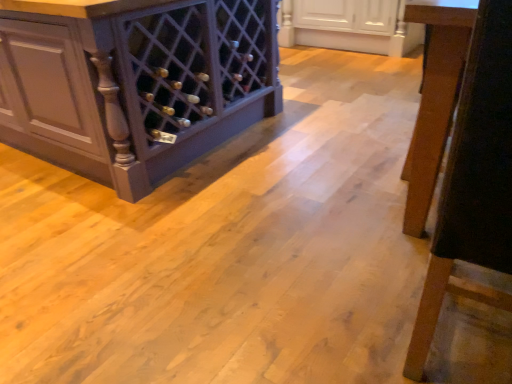
Question: From the image's perspective, is matte dark wood wine rack at left, the 1th cabinetry from the left, on top of wooden chair leg at right?

Choices:
 (A) yes
 (B) no

Answer: (A)

Question: Is matte dark wood wine rack at left, which ranks as the 2th cabinetry in right-to-left order, bigger than wooden chair leg at right?

Choices:
 (A) no
 (B) yes

Answer: (B)

Question: From the image's perspective, is matte dark wood wine rack at left, which ranks as the 2th cabinetry in right-to-left order, located beneath wooden chair leg at right?

Choices:
 (A) yes
 (B) no

Answer: (B)

Question: Is wooden chair leg at right surrounded by matte dark wood wine rack at left, which ranks as the 2th cabinetry in right-to-left order?

Choices:
 (A) yes
 (B) no

Answer: (B)

Question: Is matte dark wood wine rack at left, the 1th cabinetry from the left, aimed at wooden chair leg at right?

Choices:
 (A) yes
 (B) no

Answer: (B)

Question: From a real-world perspective, is matte dark wood wine rack at left, which ranks as the 2th cabinetry in right-to-left order, above or below wooden chair leg at right?

Choices:
 (A) below
 (B) above

Answer: (A)

Question: Based on their positions, is matte dark wood wine rack at left, which ranks as the 2th cabinetry in right-to-left order, located to the left or right of wooden chair leg at right?

Choices:
 (A) left
 (B) right

Answer: (A)

Question: Relative to wooden chair leg at right, is matte dark wood wine rack at left, the 1th cabinetry from the left, in front or behind?

Choices:
 (A) front
 (B) behind

Answer: (B)

Question: Is matte dark wood wine rack at left, the 1th cabinetry from the left, inside the boundaries of wooden chair leg at right, or outside?

Choices:
 (A) outside
 (B) inside

Answer: (A)

Question: Considering the positions of wooden chair leg at right and white glossy cabinet at upper center, which is counted as the 1th cabinetry, starting from the right, in the image, is wooden chair leg at right taller or shorter than white glossy cabinet at upper center, which is counted as the 1th cabinetry, starting from the right,?

Choices:
 (A) short
 (B) tall

Answer: (B)

Question: From a real-world perspective, relative to white glossy cabinet at upper center, which appears as the 2th cabinetry when viewed from the left, is wooden chair leg at right vertically above or below?

Choices:
 (A) below
 (B) above

Answer: (B)

Question: Looking at their shapes, would you say wooden chair leg at right is wider or thinner than white glossy cabinet at upper center, which appears as the 2th cabinetry when viewed from the left?

Choices:
 (A) wide
 (B) thin

Answer: (B)

Question: In the image, is wooden chair leg at right positioned in front of or behind white glossy cabinet at upper center, which is counted as the 1th cabinetry, starting from the right?

Choices:
 (A) front
 (B) behind

Answer: (A)

Question: Is wooden chair leg at right taller or shorter than matte dark wood wine rack at left, which ranks as the 2th cabinetry in right-to-left order?

Choices:
 (A) tall
 (B) short

Answer: (A)

Question: Choose the correct answer: Is wooden chair leg at right inside matte dark wood wine rack at left, the 1th cabinetry from the left, or outside it?

Choices:
 (A) inside
 (B) outside

Answer: (B)